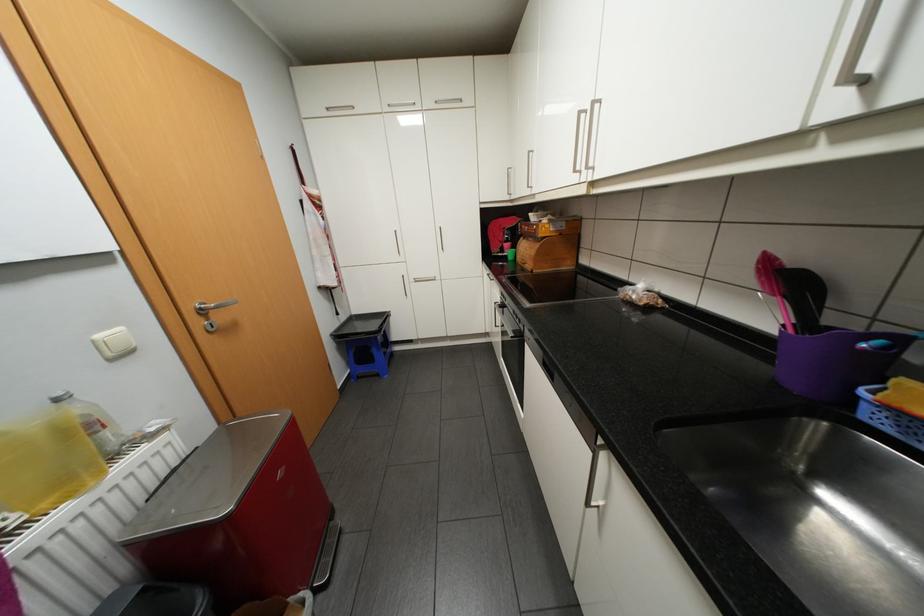
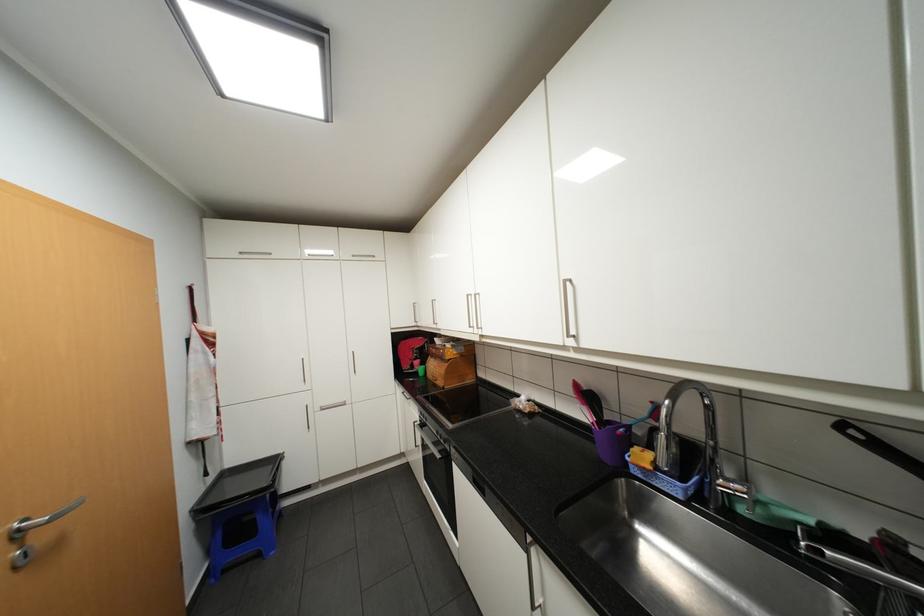
Find the pixel in the second image that matches the point at 531,237 in the first image.

(440, 355)